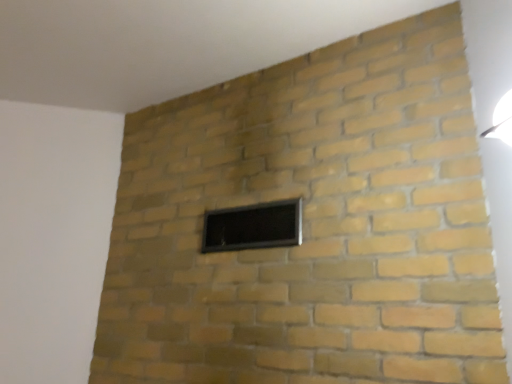
Question: Can we say black glass window at center lies outside white glossy light fixture at upper right?

Choices:
 (A) yes
 (B) no

Answer: (A)

Question: Does black glass window at center come behind white glossy light fixture at upper right?

Choices:
 (A) yes
 (B) no

Answer: (A)

Question: Is white glossy light fixture at upper right surrounded by black glass window at center?

Choices:
 (A) no
 (B) yes

Answer: (A)

Question: Could you tell me if black glass window at center is turned towards white glossy light fixture at upper right?

Choices:
 (A) no
 (B) yes

Answer: (A)

Question: Is black glass window at center closer to the viewer compared to white glossy light fixture at upper right?

Choices:
 (A) no
 (B) yes

Answer: (A)

Question: Does black glass window at center appear on the right side of white glossy light fixture at upper right?

Choices:
 (A) yes
 (B) no

Answer: (B)

Question: Is white glossy light fixture at upper right aimed at black glass window at center?

Choices:
 (A) yes
 (B) no

Answer: (B)

Question: Considering the relative sizes of white glossy light fixture at upper right and black glass window at center in the image provided, is white glossy light fixture at upper right taller than black glass window at center?

Choices:
 (A) no
 (B) yes

Answer: (A)

Question: From the image's perspective, is white glossy light fixture at upper right located beneath black glass window at center?

Choices:
 (A) no
 (B) yes

Answer: (A)

Question: Considering the relative positions of white glossy light fixture at upper right and black glass window at center in the image provided, is white glossy light fixture at upper right in front of black glass window at center?

Choices:
 (A) no
 (B) yes

Answer: (B)

Question: Is white glossy light fixture at upper right further to the viewer compared to black glass window at center?

Choices:
 (A) yes
 (B) no

Answer: (B)

Question: Does white glossy light fixture at upper right have a lesser width compared to black glass window at center?

Choices:
 (A) yes
 (B) no

Answer: (B)

Question: Is black glass window at center situated inside white glossy light fixture at upper right or outside?

Choices:
 (A) outside
 (B) inside

Answer: (A)